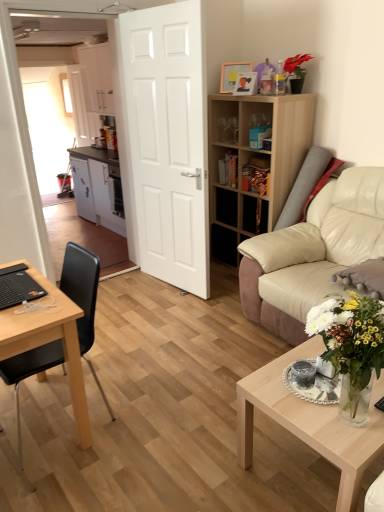
You are a GUI agent. You are given a task and a screenshot of the screen. Output one action in this format:
    pyautogui.click(x=<x>, y=<y>)
    Task: Click on the vacant area to the left of light wood coffee table at lower right
    The image size is (384, 512).
    Given the screenshot: What is the action you would take?
    pyautogui.click(x=213, y=454)